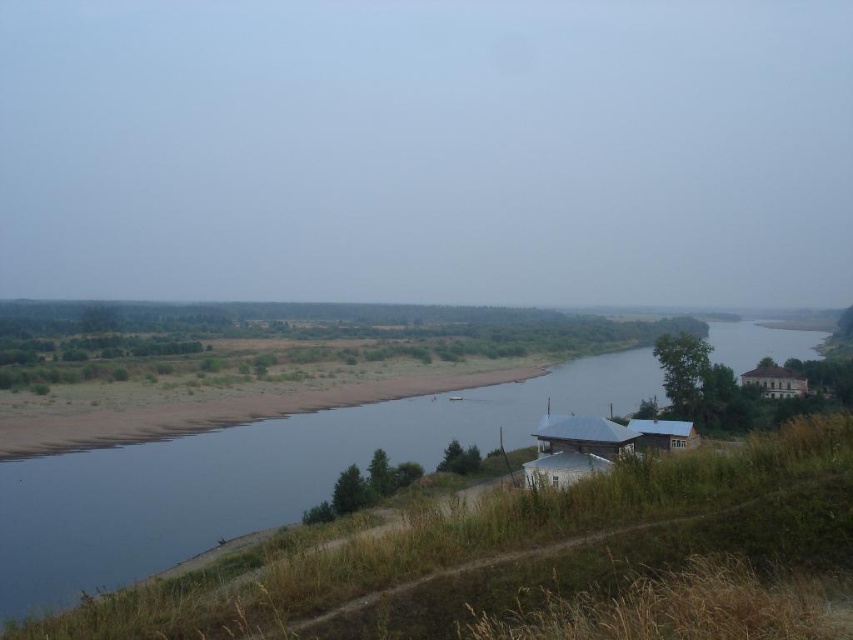
Who is taller, blue water at center or blue corrugated metal hut at lower right?

blue water at center

Looking at this image, who is positioned more to the right, blue water at center or blue corrugated metal hut at lower right?

blue water at center

The width and height of the screenshot is (853, 640). I want to click on blue water at center, so click(252, 476).

Is point (637, 442) positioned before point (746, 371)?

Yes, point (637, 442) is closer to viewer.

Which is in front, point (642, 435) or point (779, 380)?

Point (642, 435) is more forward.

Where is `blue corrugated metal hut at lower right`? The width and height of the screenshot is (853, 640). blue corrugated metal hut at lower right is located at coordinates (663, 433).

At what (x,y) coordinates should I click in order to perform the action: click on blue corrugated metal hut at lower right. Please return your answer as a coordinate pair (x, y). Image resolution: width=853 pixels, height=640 pixels. Looking at the image, I should click on (663, 433).

Consider the image. Between blue water at center and white wooden hut at lower center, which one is positioned higher?

white wooden hut at lower center is higher up.

Image resolution: width=853 pixels, height=640 pixels. What do you see at coordinates (252, 476) in the screenshot?
I see `blue water at center` at bounding box center [252, 476].

What are the coordinates of `blue water at center` in the screenshot? It's located at (252, 476).

Identify the location of blue water at center. This screenshot has width=853, height=640. (252, 476).